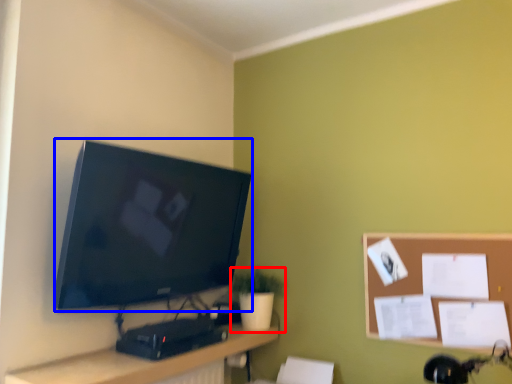
Question: Which of the following is the farthest to the observer, houseplant (highlighted by a red box) or television (highlighted by a blue box)?

Choices:
 (A) houseplant
 (B) television

Answer: (A)